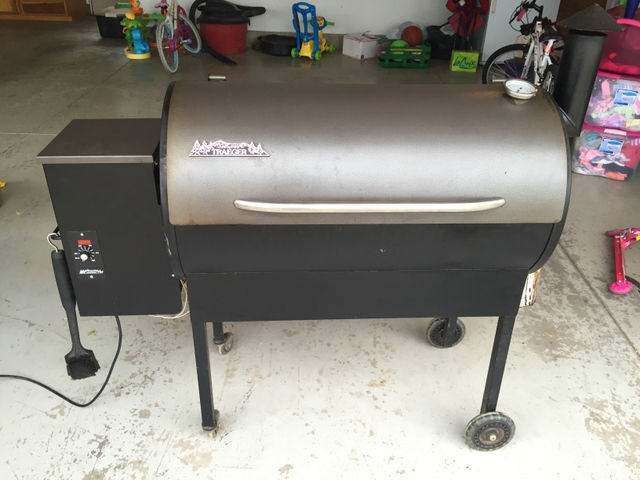
Find the location of a particular element. toys is located at coordinates (141, 35), (308, 45).